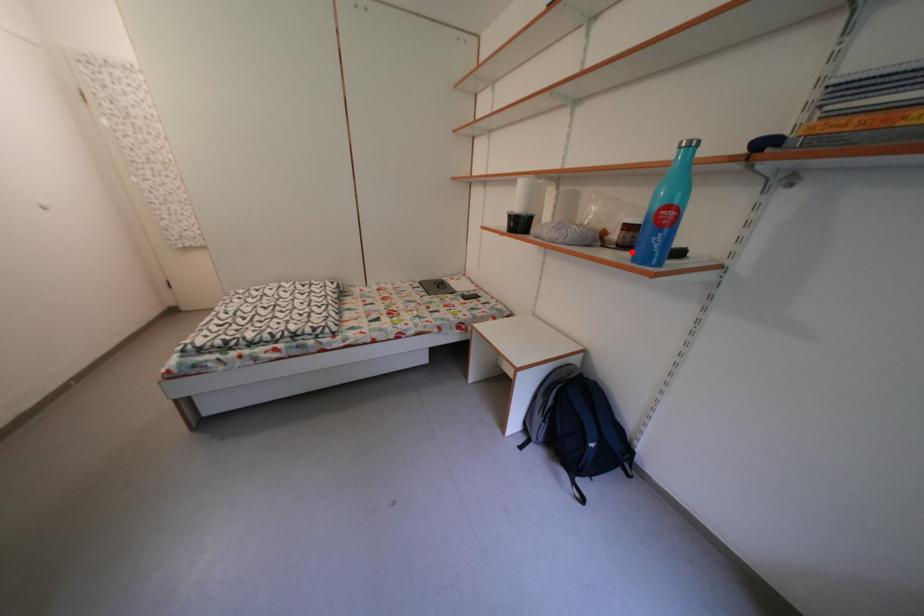
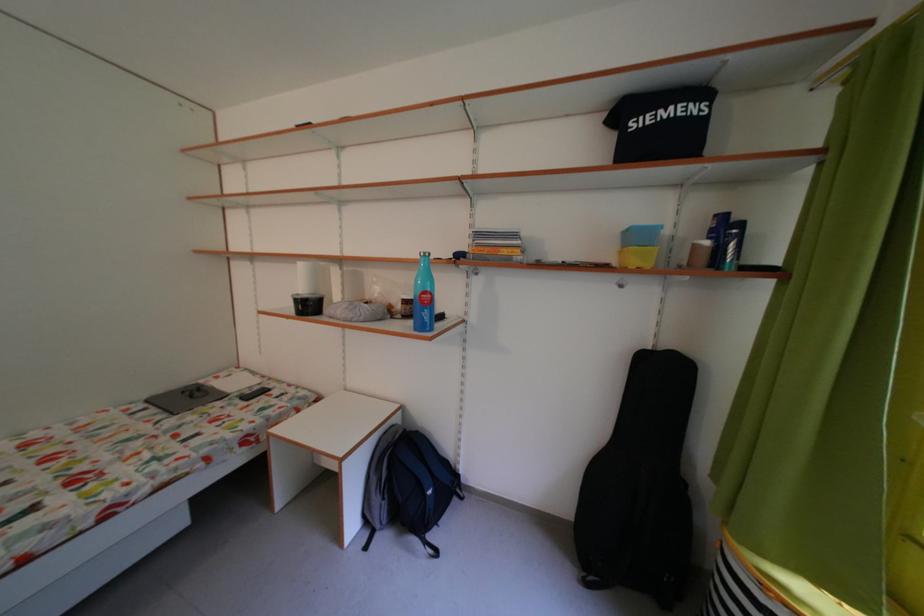
Where in the second image is the point corresponding to the highlighted location from the first image?

(416, 322)